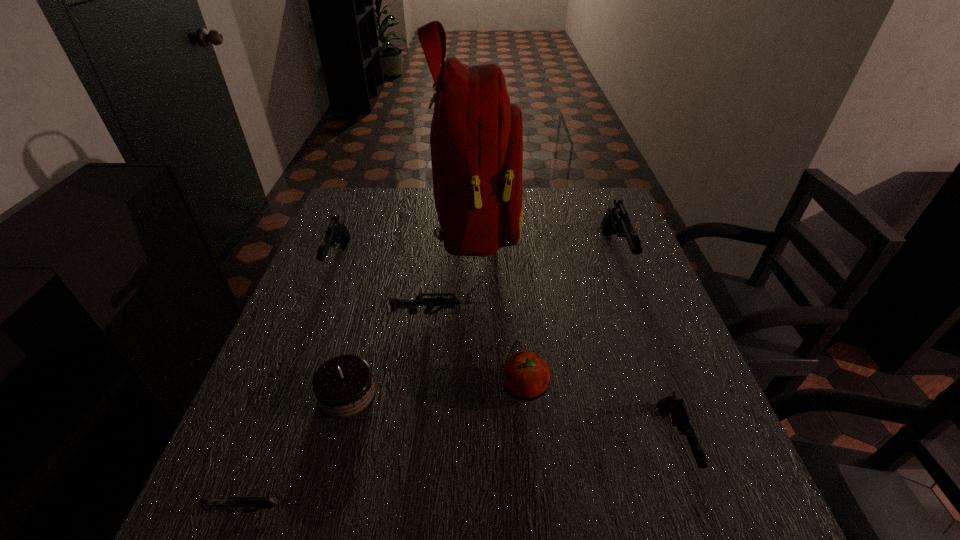
At what (x,y) coordinates should I click in order to perform the action: click on free location at the left edge of the desktop. Please return your answer as a coordinate pair (x, y). This screenshot has width=960, height=540. Looking at the image, I should click on (312, 427).

Where is `vacant space at the right edge of the desktop`? vacant space at the right edge of the desktop is located at coordinates (714, 453).

Image resolution: width=960 pixels, height=540 pixels. In the image, there is a desktop. Find the location of `free region at the far left corner`. free region at the far left corner is located at coordinates (392, 193).

Identify the location of blank space at the far right corner. (594, 201).

Identify the location of vacant area between the fourth shortest gun and the biggest black gun. (477, 257).

You are a GUI agent. You are given a task and a screenshot of the screen. Output one action in this format:
    pyautogui.click(x=<x>, y=<y>)
    Task: Click on the free space that is in between the apple and the chocolate chocolate cake
    The width and height of the screenshot is (960, 540).
    Given the screenshot: What is the action you would take?
    pyautogui.click(x=436, y=392)

At what (x,y) coordinates should I click in order to perform the action: click on empty space that is in between the second smallest black gun and the backpack. Please return your answer as a coordinate pair (x, y). Image resolution: width=960 pixels, height=540 pixels. Looking at the image, I should click on (408, 241).

The width and height of the screenshot is (960, 540). Identify the location of vacant space that is in between the right grey gun and the second smallest black gun. (388, 287).

The image size is (960, 540). In order to click on free space between the chocolate chocolate cake and the tallest gun in this screenshot , I will do `click(481, 324)`.

Locate an element on the screen. Image resolution: width=960 pixels, height=540 pixels. free spot between the chocolate chocolate cake and the smallest black gun is located at coordinates (511, 417).